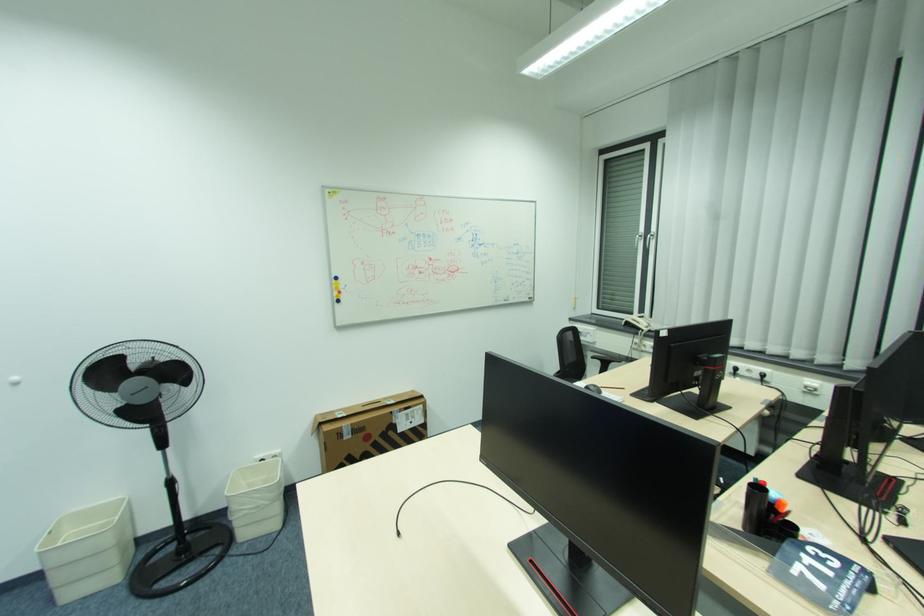
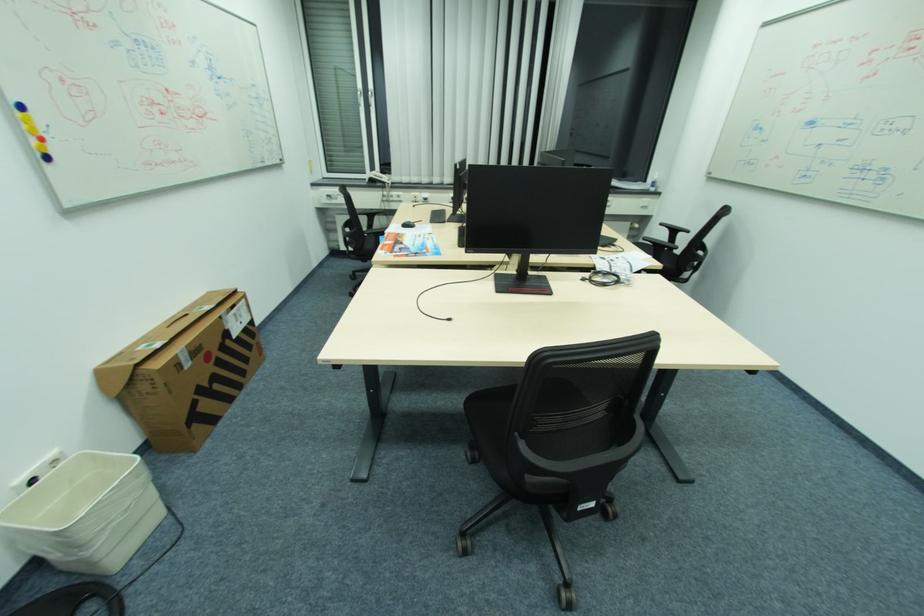
Find the pixel in the second image that matches (346,427) in the first image.

(181, 355)